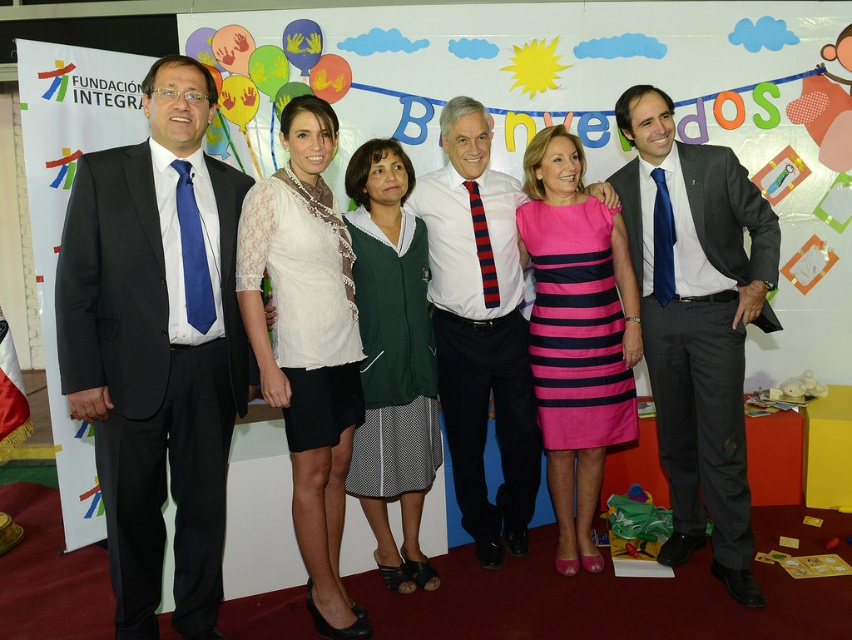
Consider the image. You are a photographer at the event and need to arrange the participants for a new photo. The director wants the person in the dark gray suit at right to be moved to the center. Which direction should you move them relative to the white lace top at center?

The dark gray suit at right is currently on the right side of the white lace top at center. To move it to the center, you should move the dark gray suit at right to the left, positioning it directly in front of or near the white lace top at center.

You are a photographer at the event and need to adjust the lighting to ensure both the white lace blouse at center and the pink striped dress at center are equally illuminated. Given their height difference, which one should you focus the light on first to account for their positions?

The white lace blouse at center is taller than the pink striped dress at center, so you should focus the light on the white lace blouse at center first to ensure proper illumination.

You are a photographer at the event and want to ensure everyone is in the frame. The camera can only capture people from the leftmost to the rightmost person. Since the dark gray suit at right is to the right of the white shirt at center, will the camera capture everyone in the frame?

Yes, the camera will capture everyone in the frame because the dark gray suit at right is the rightmost person and the white shirt at center is somewhere in the middle, so the leftmost person would be the first individual, and the rightmost is the dark gray suit at right, ensuring all are within the frame.